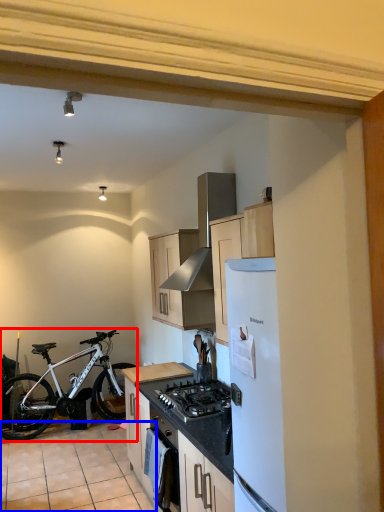
Question: Which object appears farthest to the camera in this image, bicycle (highlighted by a red box) or tile (highlighted by a blue box)?

Choices:
 (A) bicycle
 (B) tile

Answer: (A)